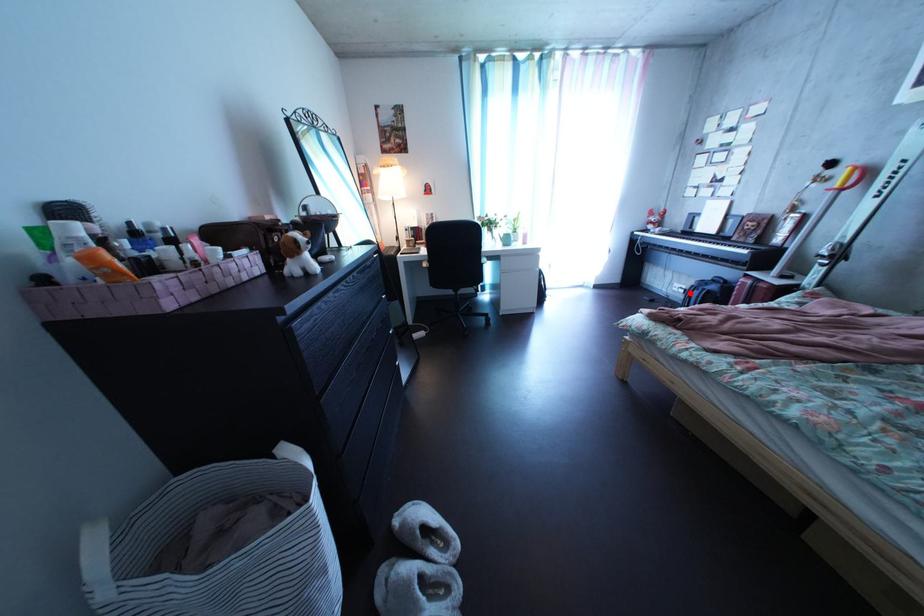
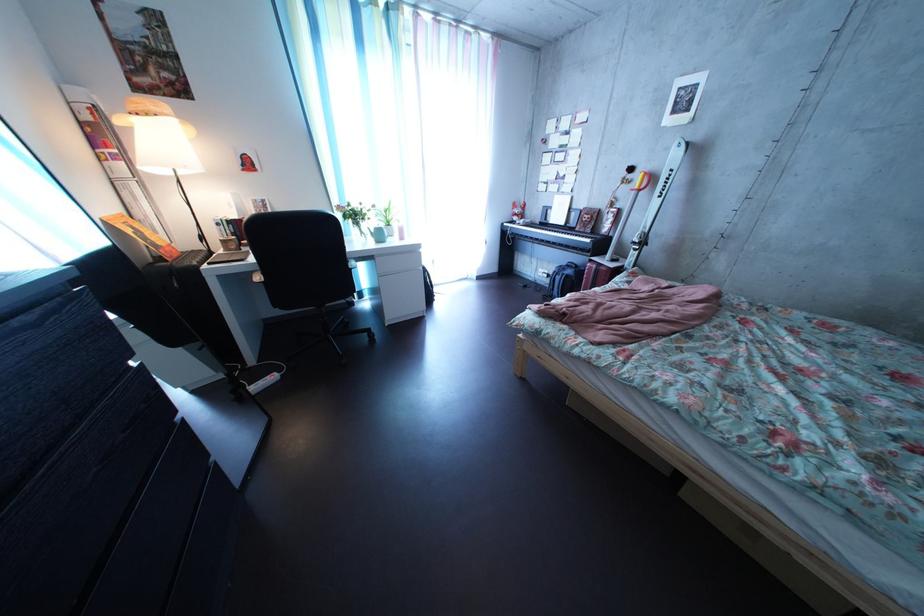
In the second image, find the point that corresponds to the highlighted location in the first image.

(554, 278)